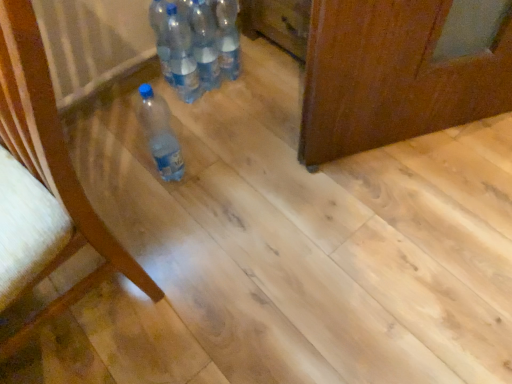
Where is `vacant area in front of translucent plastic bottles at center, which is the 2th bottle in top-to-bottom order`? This screenshot has height=384, width=512. vacant area in front of translucent plastic bottles at center, which is the 2th bottle in top-to-bottom order is located at coordinates (223, 118).